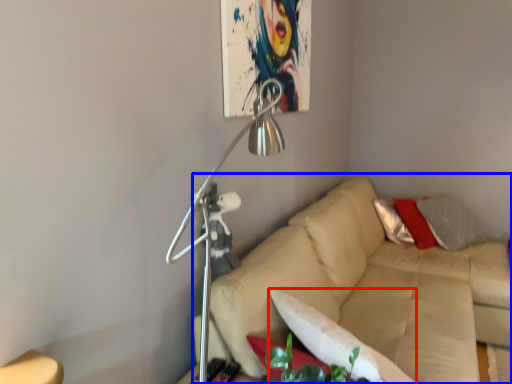
Question: Which point is further to the camera, pillow (highlighted by a red box) or studio couch (highlighted by a blue box)?

Choices:
 (A) pillow
 (B) studio couch

Answer: (B)